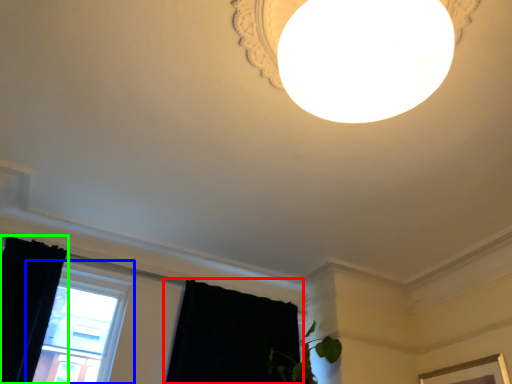
Question: Considering the real-world distances, which object is closest to curtain (highlighted by a red box)? window (highlighted by a blue box) or curtain (highlighted by a green box).

Choices:
 (A) window
 (B) curtain

Answer: (A)